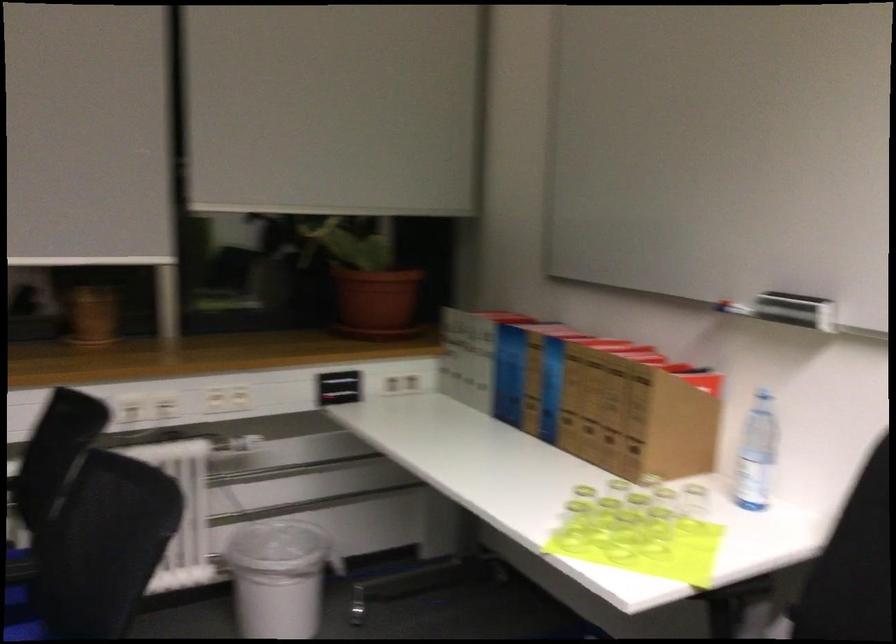
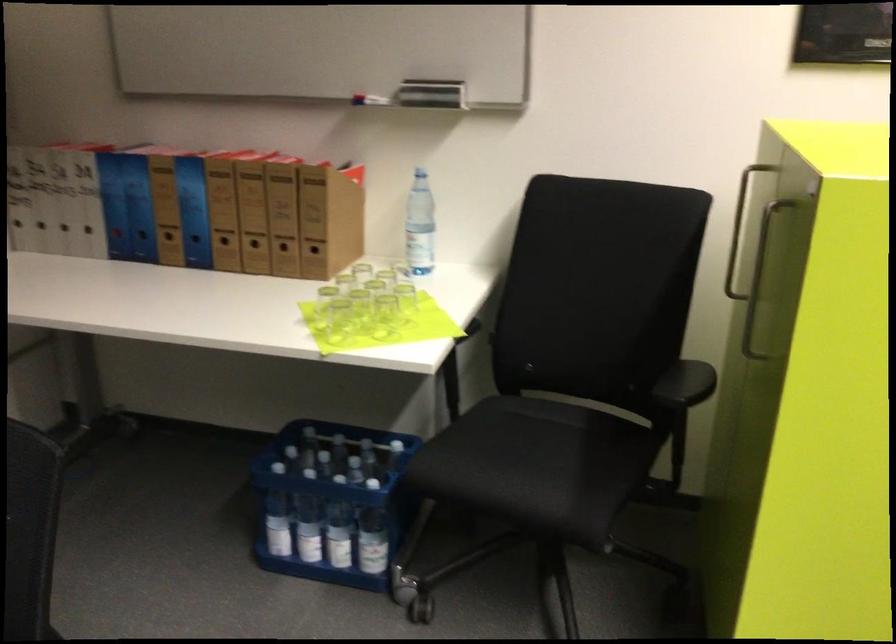
In the second image, find the point that corresponds to (x=643, y=538) in the first image.

(383, 316)